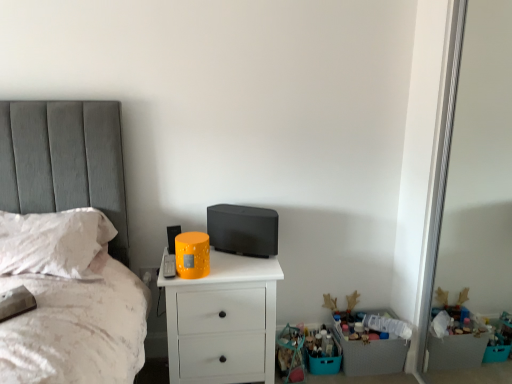
I want to click on plastic crate at lower right, so click(x=372, y=355).

This screenshot has width=512, height=384. I want to click on plastic crate at lower right, so click(372, 355).

Considering the positions of objects white matte chest of drawers at center and plastic crate at lower right in the image provided, who is more to the left, white matte chest of drawers at center or plastic crate at lower right?

white matte chest of drawers at center is more to the left.

The height and width of the screenshot is (384, 512). In order to click on crate behind the white matte chest of drawers at center in this screenshot , I will do `click(372, 355)`.

From a real-world perspective, is white matte chest of drawers at center over plastic crate at lower right?

Yes.

Does white matte chest of drawers at center have a greater width compared to plastic crate at lower right?

Correct, the width of white matte chest of drawers at center exceeds that of plastic crate at lower right.

What's the angular difference between plastic crate at lower right and white matte chest of drawers at center's facing directions?

They differ by 0.28 degrees in their facing directions.

Does plastic crate at lower right have a smaller size compared to white matte chest of drawers at center?

Yes, plastic crate at lower right is smaller than white matte chest of drawers at center.

Looking at this image, is plastic crate at lower right positioned far away from white matte chest of drawers at center?

No, plastic crate at lower right is not far away from white matte chest of drawers at center.

Does plastic crate at lower right come in front of white matte chest of drawers at center?

No.

Which object is further away from the camera taking this photo, white soft pillow at left or white matte chest of drawers at center?

white matte chest of drawers at center is further from the camera.

Identify the location of pillow above the white matte chest of drawers at center (from a real-world perspective). (53, 242).

Is white soft pillow at left inside or outside of white matte chest of drawers at center?

white soft pillow at left is located beyond the bounds of white matte chest of drawers at center.

From a real-world perspective, between white soft pillow at left and white matte chest of drawers at center, who is vertically higher?

white soft pillow at left, from a real-world perspective.

Can we say white soft pillow at left lies outside plastic crate at lower right?

Indeed, white soft pillow at left is completely outside plastic crate at lower right.

Consider the image. Between white soft pillow at left and plastic crate at lower right, which one has smaller size?

plastic crate at lower right is smaller.

From the picture: From a real-world perspective, is white soft pillow at left positioned under plastic crate at lower right based on gravity?

No, from a real-world perspective, white soft pillow at left is not under plastic crate at lower right.

Which object is further away from the camera, white soft pillow at left or plastic crate at lower right?

plastic crate at lower right is further away from the camera.

Considering the sizes of objects white matte chest of drawers at center and white soft pillow at left in the image provided, who is thinner, white matte chest of drawers at center or white soft pillow at left?

A: white matte chest of drawers at center.

From a real-world perspective, relative to white soft pillow at left, is white matte chest of drawers at center vertically above or below?

Clearly, from a real-world perspective, white matte chest of drawers at center is below white soft pillow at left.

Is white matte chest of drawers at center positioned beyond the bounds of white soft pillow at left?

That's correct, white matte chest of drawers at center is outside of white soft pillow at left.

Is white matte chest of drawers at center to the left of white soft pillow at left from the viewer's perspective?

No.

Is plastic crate at lower right inside the boundaries of white soft pillow at left, or outside?

plastic crate at lower right is spatially situated outside white soft pillow at left.

From the image's perspective, is plastic crate at lower right beneath white soft pillow at left?

Yes, from the image's perspective, plastic crate at lower right is below white soft pillow at left.

Consider the image. Which of these two, plastic crate at lower right or white soft pillow at left, stands shorter?

white soft pillow at left.

Locate an element on the screen. the chest of drawers lying in front of the plastic crate at lower right is located at coordinates 223,321.

In order to click on chest of drawers above the plastic crate at lower right (from a real-world perspective) in this screenshot , I will do `click(223, 321)`.

Based on the photo, based on their spatial positions, is white matte chest of drawers at center or white soft pillow at left closer to plastic crate at lower right?

Based on the image, white matte chest of drawers at center appears to be nearer to plastic crate at lower right.

Estimate the real-world distances between objects in this image. Which object is closer to plastic crate at lower right, white soft pillow at left or white matte chest of drawers at center?

Based on the image, white matte chest of drawers at center appears to be nearer to plastic crate at lower right.

Considering their positions, is white soft pillow at left positioned closer to white matte chest of drawers at center than plastic crate at lower right?

white soft pillow at left is positioned closer to the anchor white matte chest of drawers at center.

Considering their positions, is white matte chest of drawers at center positioned further to white soft pillow at left than plastic crate at lower right?

Among the two, plastic crate at lower right is located further to white soft pillow at left.

From the picture: Considering their positions, is plastic crate at lower right positioned further to white matte chest of drawers at center than white soft pillow at left?

Among the two, plastic crate at lower right is located further to white matte chest of drawers at center.

Estimate the real-world distances between objects in this image. Which object is further from white soft pillow at left, plastic crate at lower right or white matte chest of drawers at center?

A: The object further to white soft pillow at left is plastic crate at lower right.

You are a GUI agent. You are given a task and a screenshot of the screen. Output one action in this format:
    pyautogui.click(x=<x>, y=<y>)
    Task: Click on the chest of drawers between white soft pillow at left and plastic crate at lower right in the horizontal direction
    The height and width of the screenshot is (384, 512).
    Given the screenshot: What is the action you would take?
    pyautogui.click(x=223, y=321)